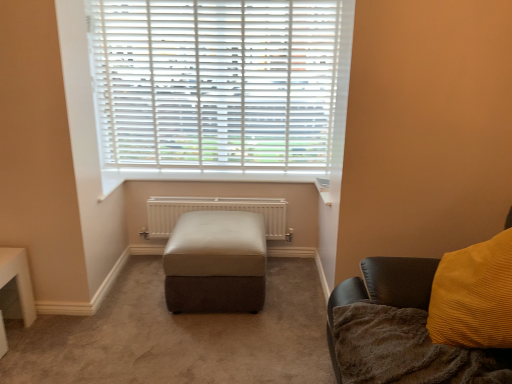
Locate an element on the screen. vacant space to the left of leather ottoman at center is located at coordinates (125, 304).